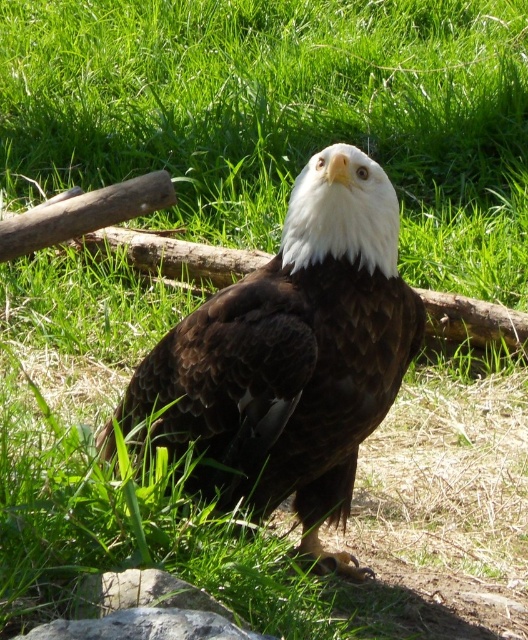
Can you confirm if gray rough stone at lower center is positioned below gray rough stone at lower left?

Yes, gray rough stone at lower center is below gray rough stone at lower left.

Can you confirm if gray rough stone at lower center is wider than gray rough stone at lower left?

Yes.

I want to click on gray rough stone at lower center, so click(x=145, y=627).

Where is `gray rough stone at lower center`? The width and height of the screenshot is (528, 640). gray rough stone at lower center is located at coordinates (145, 627).

Does brown feathered eagle at center have a smaller size compared to gray rough stone at lower left?

Incorrect, brown feathered eagle at center is not smaller in size than gray rough stone at lower left.

Which is more to the left, brown feathered eagle at center or gray rough stone at lower left?

gray rough stone at lower left is more to the left.

Between point (354, 188) and point (90, 573), which one is positioned in front?

Point (90, 573)

Identify the location of brown feathered eagle at center. (294, 356).

Who is taller, brown feathered eagle at center or gray rough stone at lower center?

With more height is brown feathered eagle at center.

Does brown feathered eagle at center have a larger size compared to gray rough stone at lower center?

Indeed, brown feathered eagle at center has a larger size compared to gray rough stone at lower center.

Find the location of a particular element. brown feathered eagle at center is located at coordinates (294, 356).

Where is `brown feathered eagle at center`? The image size is (528, 640). brown feathered eagle at center is located at coordinates (294, 356).